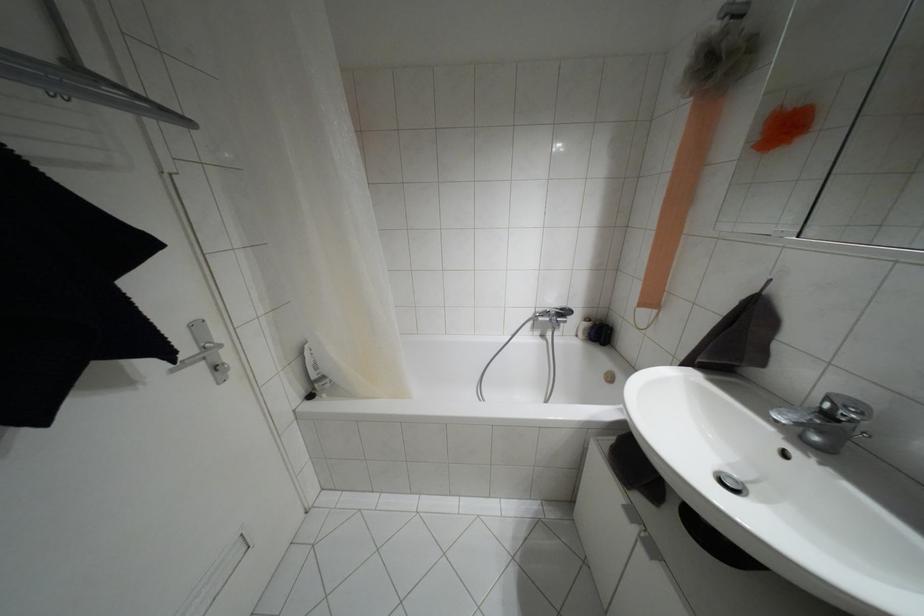
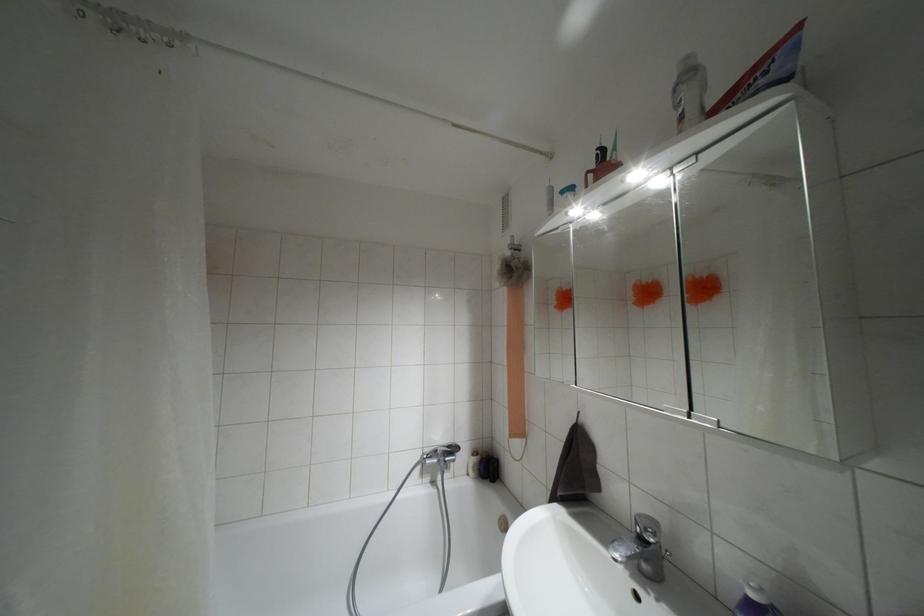
The point at (561, 309) is marked in the first image. Where is the corresponding point in the second image?

(447, 446)